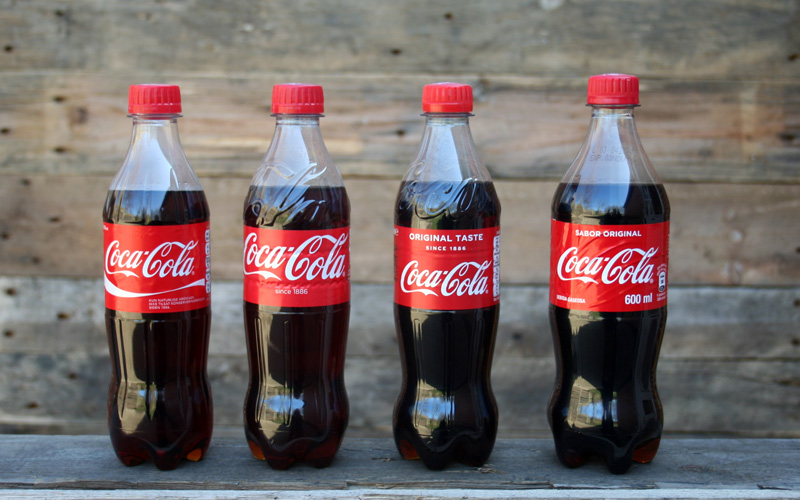
Where is `bottles`? Image resolution: width=800 pixels, height=500 pixels. bottles is located at coordinates (157, 178), (276, 170), (426, 187), (593, 190).